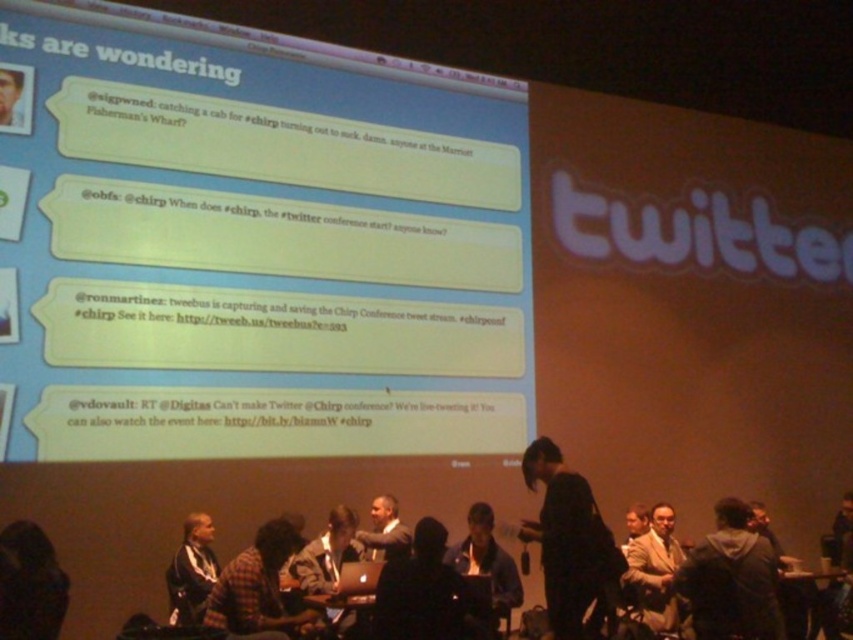
Which is in front, point (618, 572) or point (339, 506)?

Point (618, 572) is more forward.

Who is positioned more to the left, black matte dress at center or dark brown leather jacket at center?

dark brown leather jacket at center

Which is in front, point (601, 593) or point (328, 582)?

Point (601, 593) is more forward.

Find the location of a particular element. black matte dress at center is located at coordinates click(x=567, y=541).

Who is shorter, dark hair at lower left or smooth skin face at upper left?

smooth skin face at upper left is shorter.

Is dark hair at lower left smaller than smooth skin face at upper left?

Incorrect, dark hair at lower left is not smaller in size than smooth skin face at upper left.

Image resolution: width=853 pixels, height=640 pixels. I want to click on dark hair at lower left, so click(28, 582).

You are a GUI agent. You are given a task and a screenshot of the screen. Output one action in this format:
    pyautogui.click(x=<x>, y=<y>)
    Task: Click on the dark hair at lower left
    The width and height of the screenshot is (853, 640).
    Given the screenshot: What is the action you would take?
    pyautogui.click(x=28, y=582)

Does dark brown leather jacket at center appear on the left side of dark gray fabric jacket at center?

Correct, you'll find dark brown leather jacket at center to the left of dark gray fabric jacket at center.

Who is taller, dark brown leather jacket at center or dark gray fabric jacket at center?

Standing taller between the two is dark gray fabric jacket at center.

Which is in front, point (351, 545) or point (477, 513)?

Point (351, 545)

Locate an element on the screen. dark brown leather jacket at center is located at coordinates (328, 554).